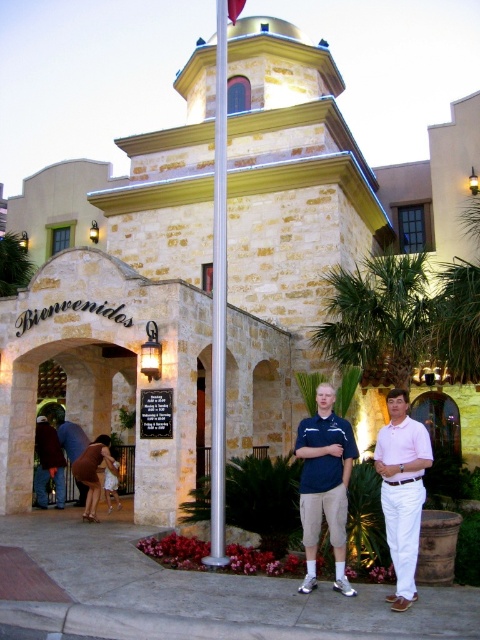
Does blue cotton shirt at center appear on the right side of brown fabric dress at lower left?

Indeed, blue cotton shirt at center is positioned on the right side of brown fabric dress at lower left.

Who is shorter, blue cotton shirt at center or brown fabric dress at lower left?

With less height is brown fabric dress at lower left.

At what (x,y) coordinates should I click in order to perform the action: click on blue cotton shirt at center. Please return your answer as a coordinate pair (x, y). The width and height of the screenshot is (480, 640). Looking at the image, I should click on (403, 490).

Between silver metallic flag pole at center and brown leather dress at lower left, which one is positioned lower?

brown leather dress at lower left

Between silver metallic flag pole at center and brown leather dress at lower left, which one appears on the left side from the viewer's perspective?

From the viewer's perspective, brown leather dress at lower left appears more on the left side.

Does point (217, 308) lie in front of point (107, 436)?

That is True.

You are a GUI agent. You are given a task and a screenshot of the screen. Output one action in this format:
    pyautogui.click(x=<x>, y=<y>)
    Task: Click on the silver metallic flag pole at center
    The image size is (480, 640).
    Given the screenshot: What is the action you would take?
    pyautogui.click(x=219, y=292)

Which is in front, point (338, 557) or point (72, 442)?

Positioned in front is point (338, 557).

Can you confirm if dark blue shirt at center is smaller than brown leather jacket at lower left?

Indeed, dark blue shirt at center has a smaller size compared to brown leather jacket at lower left.

Which is in front, point (315, 493) or point (81, 429)?

Point (315, 493) is in front.

The image size is (480, 640). I want to click on dark blue shirt at center, so click(324, 484).